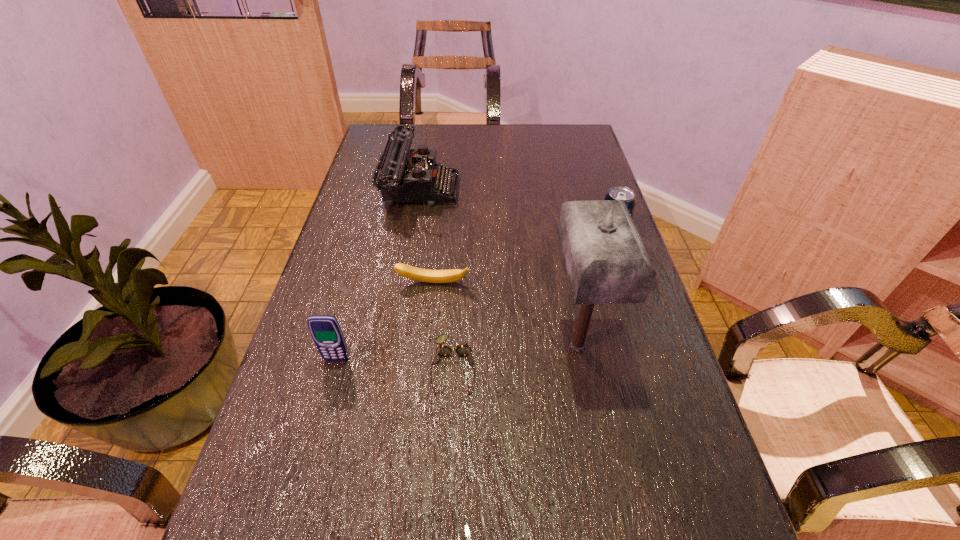
Where is `free area in between the typewriter and the second object from right to left`? This screenshot has width=960, height=540. free area in between the typewriter and the second object from right to left is located at coordinates (498, 267).

Locate an element on the screen. This screenshot has height=540, width=960. vacant area that lies between the tallest object and the typewriter is located at coordinates (498, 267).

Identify the location of empty space that is in between the banana and the fifth nearest object. (522, 260).

You are a GUI agent. You are given a task and a screenshot of the screen. Output one action in this format:
    pyautogui.click(x=<x>, y=<y>)
    Task: Click on the vacant region between the farthest object and the tallest object
    This screenshot has height=540, width=960.
    Given the screenshot: What is the action you would take?
    pyautogui.click(x=498, y=267)

Point out which object is positioned as the nearest to the shortest object. Please provide its 2D coordinates. Your answer should be formatted as a tuple, i.e. [(x, y)], where the tuple contains the x and y coordinates of a point satisfying the conditions above.

[(424, 275)]

This screenshot has width=960, height=540. Find the location of `object that stands as the fifth closest to the mallet`. object that stands as the fifth closest to the mallet is located at coordinates (325, 330).

The image size is (960, 540). In order to click on vacant space that satisfies the following two spatial constraints: 1. on the keyboard of the typewriter; 2. on the left side of the second object from right to left in this screenshot , I will do `click(393, 346)`.

Where is `free space that satisfies the following two spatial constraints: 1. on the keyboard of the typewriter; 2. on the right side of the fifth nearest object`? Image resolution: width=960 pixels, height=540 pixels. free space that satisfies the following two spatial constraints: 1. on the keyboard of the typewriter; 2. on the right side of the fifth nearest object is located at coordinates (411, 237).

Locate an element on the screen. This screenshot has width=960, height=540. vacant space that satisfies the following two spatial constraints: 1. on the keyboard of the mallet; 2. on the left side of the typewriter is located at coordinates (393, 346).

You are a GUI agent. You are given a task and a screenshot of the screen. Output one action in this format:
    pyautogui.click(x=<x>, y=<y>)
    Task: Click on the free location that satisfies the following two spatial constraints: 1. on the back side of the fifth nearest object; 2. on the keyboard of the typewriter
    This screenshot has width=960, height=540.
    Given the screenshot: What is the action you would take?
    pyautogui.click(x=595, y=188)